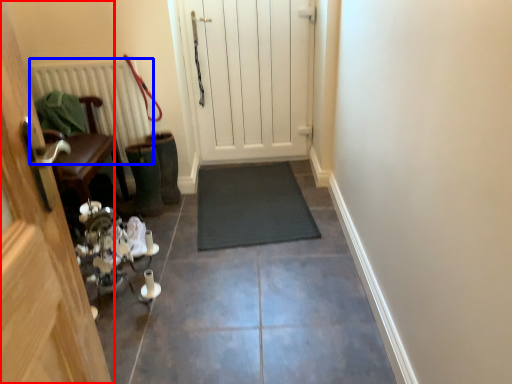
Question: Which object appears farthest to the camera in this image, door (highlighted by a red box) or radiator (highlighted by a blue box)?

Choices:
 (A) door
 (B) radiator

Answer: (B)